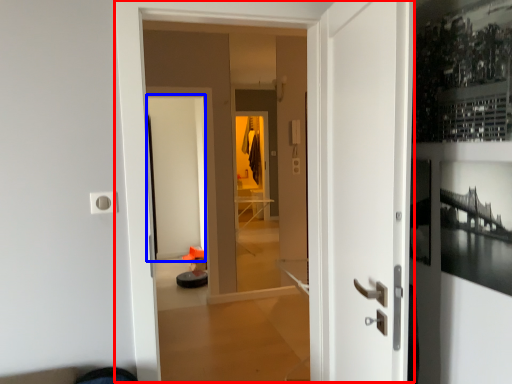
Question: Which object is closer to the camera taking this photo, door (highlighted by a red box) or screen door (highlighted by a blue box)?

Choices:
 (A) door
 (B) screen door

Answer: (A)